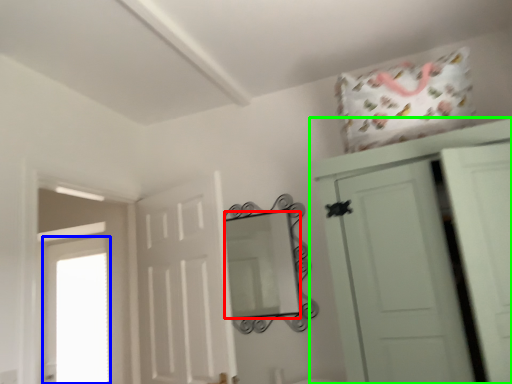
Question: Which is farther away from mirror (highlighted by a red box)? window (highlighted by a blue box) or cupboard (highlighted by a green box)?

Choices:
 (A) window
 (B) cupboard

Answer: (A)